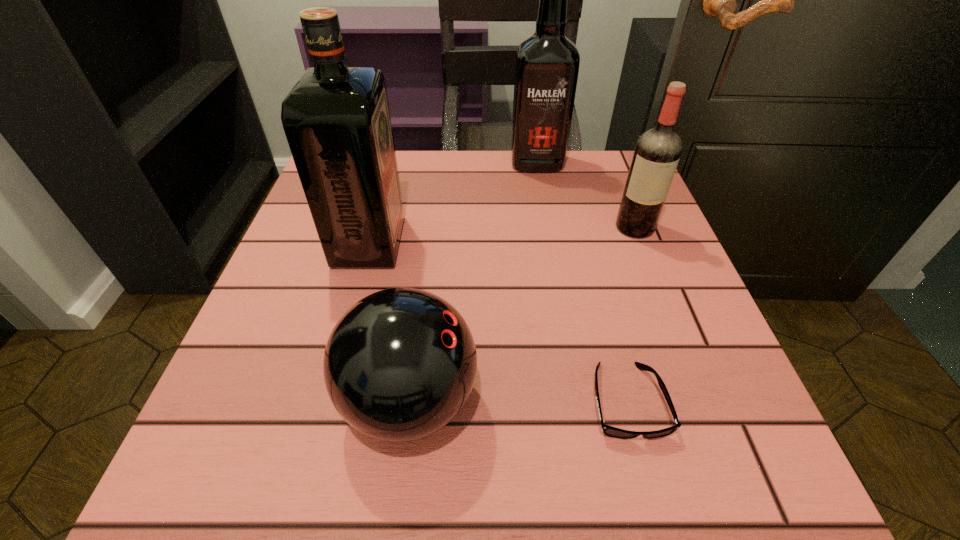
This screenshot has height=540, width=960. I want to click on vacant area situated 0.270m on the surface of the bowling ball near the finger holes, so click(x=670, y=401).

Identify the location of object that is at the far edge. This screenshot has height=540, width=960. point(547,64).

The image size is (960, 540). Identify the location of bowling ball that is at the near edge. (399, 365).

Locate an element on the screen. This screenshot has width=960, height=540. sunglasses at the near edge is located at coordinates (609, 431).

The width and height of the screenshot is (960, 540). Find the location of `object present at the left edge`. object present at the left edge is located at coordinates (336, 119).

Locate an element on the screen. liquor positioned at the right edge is located at coordinates (657, 152).

Identify the location of sunglasses situated at the right edge. The height and width of the screenshot is (540, 960). (x=609, y=431).

Image resolution: width=960 pixels, height=540 pixels. Find the location of `object that is at the near right corner`. object that is at the near right corner is located at coordinates 609,431.

The image size is (960, 540). In order to click on vacant area at the far edge of the desktop in this screenshot , I will do `click(535, 204)`.

This screenshot has width=960, height=540. In the image, there is a desktop. Find the location of `vacant area at the near edge`. vacant area at the near edge is located at coordinates (482, 487).